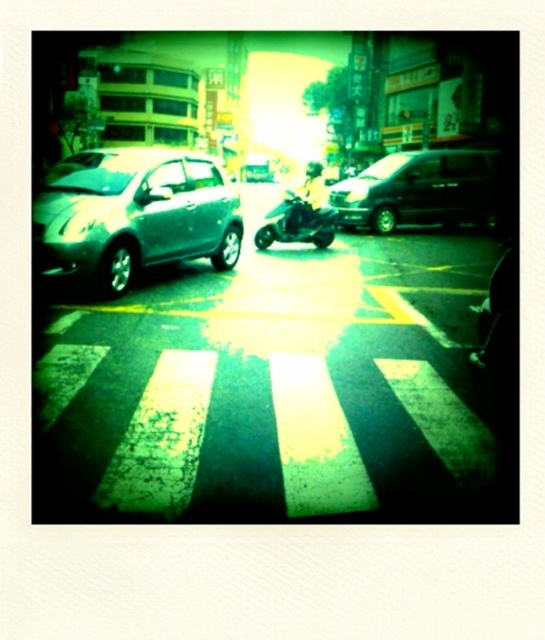
Is satin silver car at left wider than black matte van at center?

No, satin silver car at left is not wider than black matte van at center.

Measure the distance from satin silver car at left to black matte van at center.

They are 6.79 meters apart.

This screenshot has height=640, width=545. What do you see at coordinates (135, 214) in the screenshot? I see `satin silver car at left` at bounding box center [135, 214].

Find the location of a particular element. satin silver car at left is located at coordinates (135, 214).

Who is lower down, satin silver car at left or green matte motorcycle at center?

Positioned lower is satin silver car at left.

Image resolution: width=545 pixels, height=640 pixels. What are the coordinates of `satin silver car at left` in the screenshot? It's located at (135, 214).

What do you see at coordinates (135, 214) in the screenshot?
I see `satin silver car at left` at bounding box center [135, 214].

Locate an element on the screen. satin silver car at left is located at coordinates (135, 214).

Who is more forward, [456,195] or [308,232]?

Point [308,232]

Is black matte van at center to the left of green matte motorcycle at center from the viewer's perspective?

Incorrect, black matte van at center is not on the left side of green matte motorcycle at center.

The height and width of the screenshot is (640, 545). Describe the element at coordinates (419, 189) in the screenshot. I see `black matte van at center` at that location.

Locate an element on the screen. The image size is (545, 640). black matte van at center is located at coordinates (419, 189).